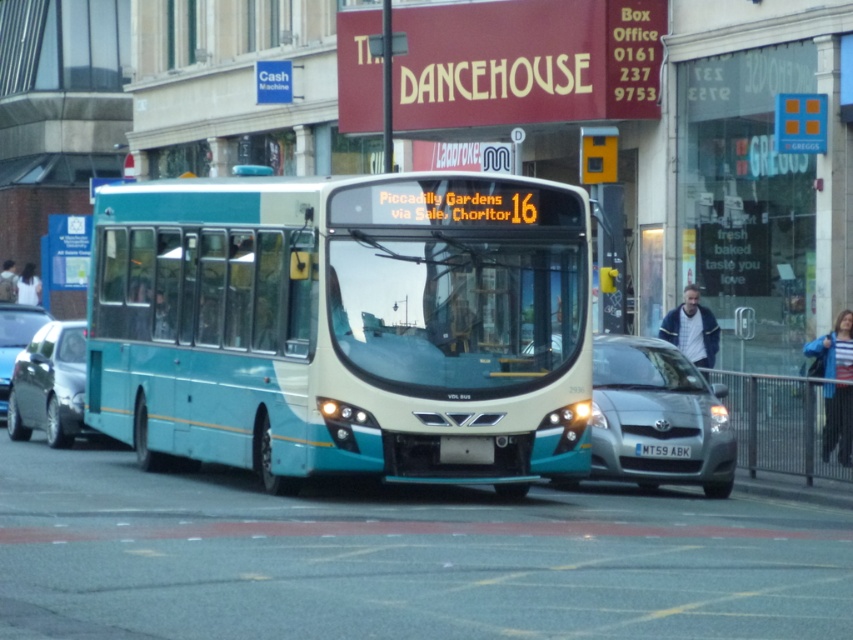
Question: Which point is farther from the camera taking this photo?

Choices:
 (A) (685, 394)
 (B) (13, 355)
 (C) (173, 387)

Answer: (B)

Question: Which object appears closest to the camera in this image?

Choices:
 (A) metallic silver car at center
 (B) metallic silver car at left

Answer: (B)

Question: Observing the image, what is the correct spatial positioning of metallic silver car at left in reference to white plastic license plate at center?

Choices:
 (A) left
 (B) right

Answer: (A)

Question: Is teal matte bus at center positioned at the back of metallic silver car at left?

Choices:
 (A) no
 (B) yes

Answer: (A)

Question: Which point is farther to the camera?

Choices:
 (A) (50, 346)
 (B) (671, 444)
 (C) (9, 372)
 (D) (659, 404)

Answer: (C)

Question: Can you confirm if metallic silver car at center is thinner than white plastic license plate at center?

Choices:
 (A) yes
 (B) no

Answer: (B)